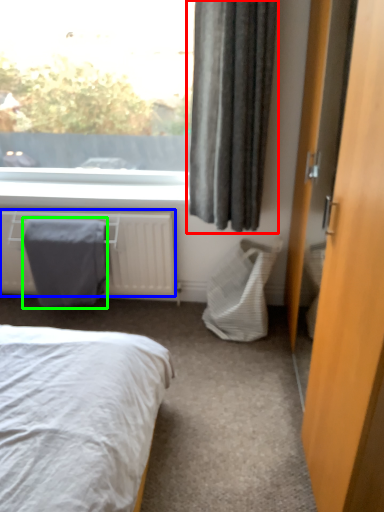
Question: Which is farther away from curtain (highlighted by a red box)? radiator (highlighted by a blue box) or blanket (highlighted by a green box)?

Choices:
 (A) radiator
 (B) blanket

Answer: (B)